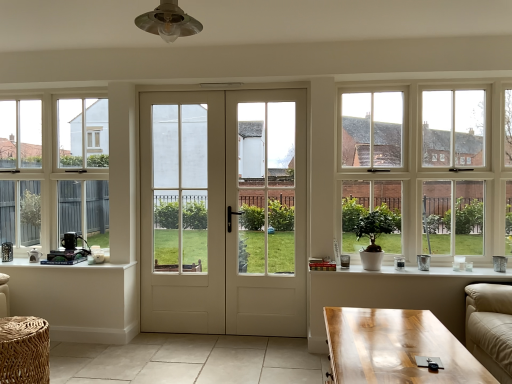
Question: Is clear glass window at left, arranged as the second window when viewed from the front, to the right of white glossy door at center, marked as the first screen door in a right-to-left arrangement, from the viewer's perspective?

Choices:
 (A) yes
 (B) no

Answer: (B)

Question: From a real-world perspective, is clear glass window at left, arranged as the second window when viewed from the front, located beneath white glossy door at center, marked as the first screen door in a right-to-left arrangement?

Choices:
 (A) no
 (B) yes

Answer: (A)

Question: Could white glossy door at center, marked as the first screen door in a right-to-left arrangement, be considered to be inside clear glass window at left, placed as the second window when sorted from right to left?

Choices:
 (A) yes
 (B) no

Answer: (B)

Question: Is clear glass window at left, which is the 1th window from left to right, oriented towards white glossy door at center, marked as the first screen door in a right-to-left arrangement?

Choices:
 (A) yes
 (B) no

Answer: (B)

Question: Considering the relative sizes of clear glass window at left, arranged as the second window when viewed from the front, and white glossy door at center, marked as the first screen door in a right-to-left arrangement, in the image provided, is clear glass window at left, arranged as the second window when viewed from the front, bigger than white glossy door at center, marked as the first screen door in a right-to-left arrangement,?

Choices:
 (A) yes
 (B) no

Answer: (A)

Question: From the image's perspective, relative to clear glass window at left, arranged as the second window when viewed from the front, is woven rattan table at lower left, which is the 1th table from front to back, above or below?

Choices:
 (A) below
 (B) above

Answer: (A)

Question: Choose the correct answer: Is woven rattan table at lower left, which is the second table in back-to-front order, inside clear glass window at left, placed as the 1th window when sorted from back to front, or outside it?

Choices:
 (A) outside
 (B) inside

Answer: (A)

Question: From a real-world perspective, is woven rattan table at lower left, which is the second table in back-to-front order, physically located above or below clear glass window at left, placed as the 1th window when sorted from back to front?

Choices:
 (A) above
 (B) below

Answer: (B)

Question: Relative to clear glass window at left, placed as the 1th window when sorted from back to front, is woven rattan table at lower left, which is the second table in back-to-front order, in front or behind?

Choices:
 (A) front
 (B) behind

Answer: (A)

Question: Is white glass door at center, which is the second screen door in right-to-left order, taller or shorter than white glossy door at center, marked as the first screen door in a right-to-left arrangement?

Choices:
 (A) short
 (B) tall

Answer: (B)

Question: From a real-world perspective, is white glass door at center, which is counted as the 1th screen door, starting from the left, physically located above or below white glossy door at center, the second screen door from the left?

Choices:
 (A) above
 (B) below

Answer: (B)

Question: Based on their sizes in the image, would you say white glass door at center, which is counted as the 1th screen door, starting from the left, is bigger or smaller than white glossy door at center, marked as the first screen door in a right-to-left arrangement?

Choices:
 (A) big
 (B) small

Answer: (B)

Question: Do you think white glass door at center, which is counted as the 1th screen door, starting from the left, is within white glossy door at center, marked as the first screen door in a right-to-left arrangement, or outside of it?

Choices:
 (A) outside
 (B) inside

Answer: (A)

Question: Is white ceramic pot at lower right bigger or smaller than white glass door at center, which is the second screen door in right-to-left order?

Choices:
 (A) big
 (B) small

Answer: (B)

Question: Considering the positions of point (364, 274) and point (152, 162), is point (364, 274) closer or farther from the camera than point (152, 162)?

Choices:
 (A) farther
 (B) closer

Answer: (B)